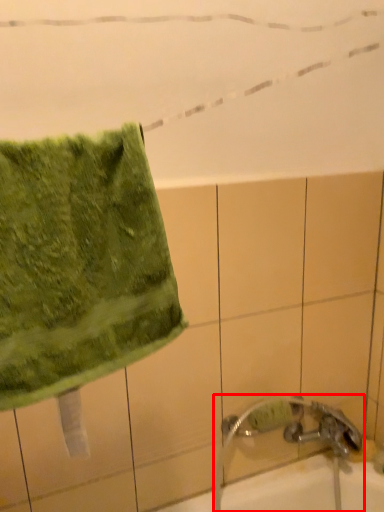
Question: In this image, where is faucet (annotated by the red box) located relative to towel?

Choices:
 (A) right
 (B) left

Answer: (A)